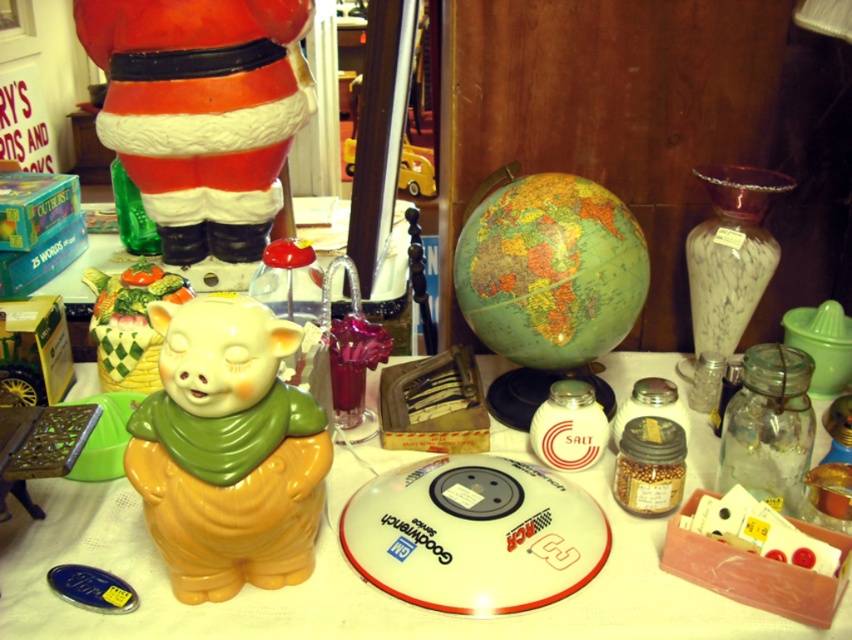
Which is behind, point (602, 483) or point (262, 422)?

Positioned behind is point (602, 483).

Does matte ceramic piggy bank at center-left have a lesser height compared to matte ceramic piggy bank at lower left?

Yes, matte ceramic piggy bank at center-left is shorter than matte ceramic piggy bank at lower left.

The width and height of the screenshot is (852, 640). What do you see at coordinates (347, 580) in the screenshot? I see `matte ceramic piggy bank at center-left` at bounding box center [347, 580].

Image resolution: width=852 pixels, height=640 pixels. What are the coordinates of `matte ceramic piggy bank at center-left` in the screenshot? It's located at (347, 580).

Who is positioned more to the right, matte ceramic piggy bank at lower left or matte ceramic pig at center?

matte ceramic piggy bank at lower left is more to the right.

What do you see at coordinates (227, 451) in the screenshot? I see `matte ceramic piggy bank at lower left` at bounding box center [227, 451].

Identify the location of matte ceramic piggy bank at lower left. (227, 451).

Measure the distance between point (217, 483) and camera.

Point (217, 483) is 29.50 inches away from camera.

The image size is (852, 640). In order to click on matte ceramic piggy bank at lower left in this screenshot , I will do [227, 451].